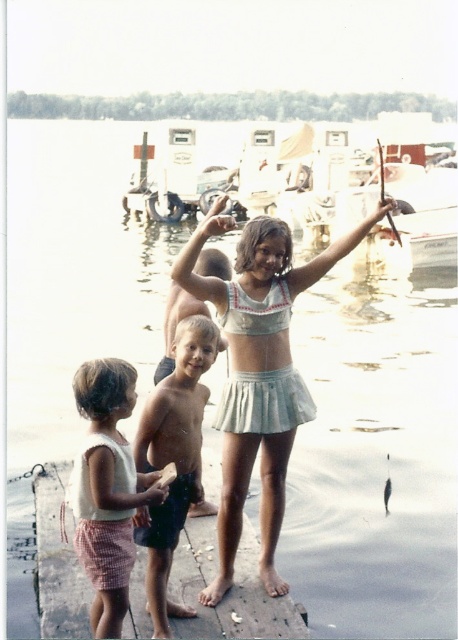
Question: Which object appears closest to the camera in this image?

Choices:
 (A) light brown skin boy at center
 (B) white cotton bikini top at center
 (C) wooden dock at center

Answer: (A)

Question: Among these objects, which one is farthest from the camera?

Choices:
 (A) white cotton bikini top at center
 (B) light brown skin boy at center

Answer: (A)

Question: Does white cotton bikini top at center appear under light brown skin boy at center?

Choices:
 (A) yes
 (B) no

Answer: (B)

Question: Does wooden dock at center have a larger size compared to white cotton tank top at lower left?

Choices:
 (A) yes
 (B) no

Answer: (A)

Question: Among these points, which one is farthest from the camera?

Choices:
 (A) (277, 492)
 (B) (151, 432)

Answer: (A)

Question: Can you confirm if white cotton bikini top at center is positioned below white cotton tank top at lower left?

Choices:
 (A) no
 (B) yes

Answer: (A)